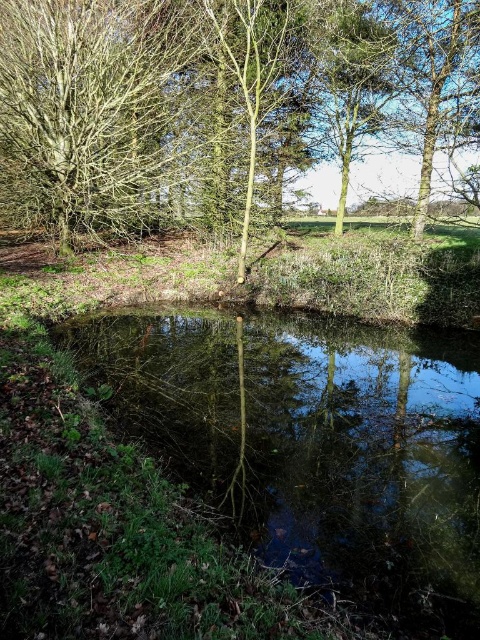
Question: Considering the relative positions of green matte tree at center and green reflective water at center in the image provided, where is green matte tree at center located with respect to green reflective water at center?

Choices:
 (A) above
 (B) below

Answer: (A)

Question: Is green matte tree at center behind green reflective water at center?

Choices:
 (A) yes
 (B) no

Answer: (A)

Question: Which point is closer to the camera taking this photo?

Choices:
 (A) (72, 124)
 (B) (292, 442)

Answer: (B)

Question: Can you confirm if green matte tree at center is positioned to the left of green reflective water at center?

Choices:
 (A) yes
 (B) no

Answer: (B)

Question: Which point is farther from the camera taking this photo?

Choices:
 (A) (317, 342)
 (B) (104, 132)

Answer: (B)